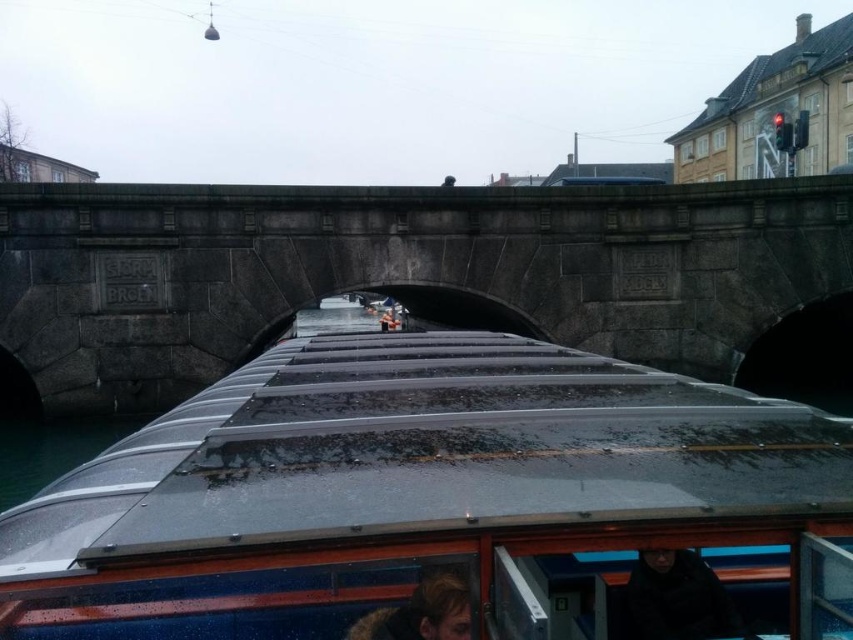
Which is below, clear glass water at lower left or dark brown hair at lower center?

clear glass water at lower left is lower down.

The height and width of the screenshot is (640, 853). In order to click on clear glass water at lower left in this screenshot , I will do `click(51, 449)`.

How distant is transparent plastic boat at center from clear glass water at lower left?

They are 7.52 meters apart.

Which of these two, transparent plastic boat at center or clear glass water at lower left, stands shorter?

With less height is clear glass water at lower left.

Is point (312, 518) in front of point (80, 444)?

Yes, it is in front of point (80, 444).

The width and height of the screenshot is (853, 640). I want to click on transparent plastic boat at center, so click(x=434, y=499).

Does transparent plastic boat at center have a lesser height compared to black matte jacket at lower center?

Incorrect, transparent plastic boat at center's height does not fall short of black matte jacket at lower center's.

Which is below, transparent plastic boat at center or black matte jacket at lower center?

black matte jacket at lower center is below.

What are the coordinates of `transparent plastic boat at center` in the screenshot? It's located at (434, 499).